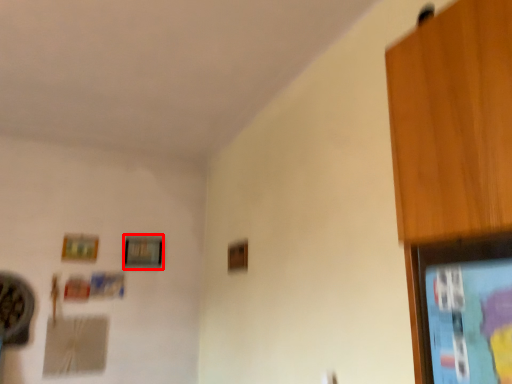
Question: Considering the relative positions of picture frame (annotated by the red box) and picture frame in the image provided, where is picture frame (annotated by the red box) located with respect to the staircase?

Choices:
 (A) right
 (B) left

Answer: (A)